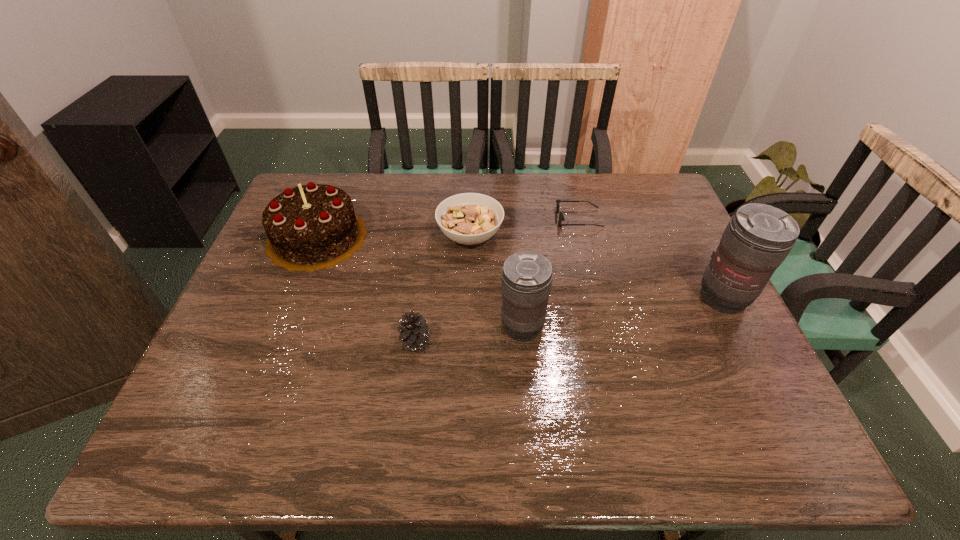
Identify the location of vacant space located on the side of the shorter telephoto lens where the control switches are located. (437, 327).

Identify the location of vacant space located 0.230m on the side of the rightmost object where the control switches are located. Image resolution: width=960 pixels, height=540 pixels. (779, 406).

You are a GUI agent. You are given a task and a screenshot of the screen. Output one action in this format:
    pyautogui.click(x=<x>, y=<y>)
    Task: Click on the vacant space located on the right of the leftmost object
    This screenshot has height=540, width=960.
    Given the screenshot: What is the action you would take?
    pyautogui.click(x=476, y=237)

Locate an element on the screen. vacant space situated on the right of the stew is located at coordinates (640, 236).

The width and height of the screenshot is (960, 540). What are the coordinates of `vacant region located on the front-facing side of the sunglasses` in the screenshot? It's located at coord(466,218).

The image size is (960, 540). What are the coordinates of `free space located on the front-facing side of the sunglasses` in the screenshot? It's located at (535, 218).

At what (x,y) coordinates should I click in order to perform the action: click on vacant space located on the front-facing side of the sunglasses. Please return your answer as a coordinate pair (x, y). The width and height of the screenshot is (960, 540). Looking at the image, I should click on (538, 218).

Where is `vacant position located on the right of the pinecone`? Image resolution: width=960 pixels, height=540 pixels. vacant position located on the right of the pinecone is located at coordinates (483, 341).

The height and width of the screenshot is (540, 960). I want to click on birthday cake that is at the far edge, so click(x=311, y=227).

Identify the location of stew located at the far edge. This screenshot has width=960, height=540. (469, 218).